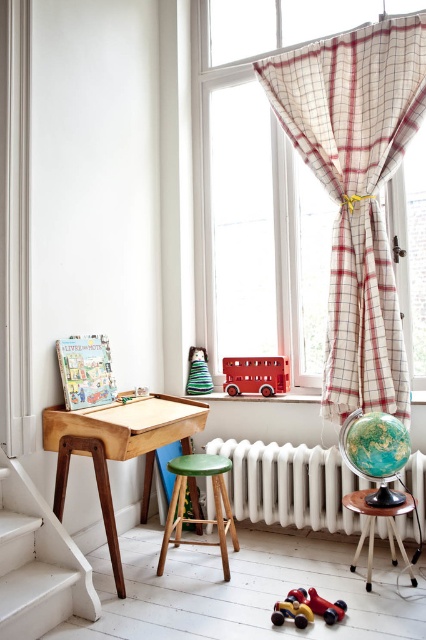
Question: From the image, what is the correct spatial relationship of wooden desk at lower left in relation to green striped fabric cone at center?

Choices:
 (A) left
 (B) right

Answer: (A)

Question: Which of these objects is positioned farthest from the rubberized plastic toy car at lower center?

Choices:
 (A) green wood stool at lower center
 (B) white wooden stair at lower left

Answer: (B)

Question: Which object appears closest to the camera in this image?

Choices:
 (A) green matte stool at center
 (B) wooden desk at lower left
 (C) white textured radiator at center
 (D) matte wooden easel at lower left

Answer: (B)

Question: Which of the following is the closest to the observer?

Choices:
 (A) (333, 416)
 (B) (31, 593)
 (C) (334, 621)

Answer: (B)

Question: Is white textured radiator at center positioned before matte wooden easel at lower left?

Choices:
 (A) no
 (B) yes

Answer: (A)

Question: Can you confirm if wooden desk at lower left is thinner than green striped fabric cone at center?

Choices:
 (A) no
 (B) yes

Answer: (A)